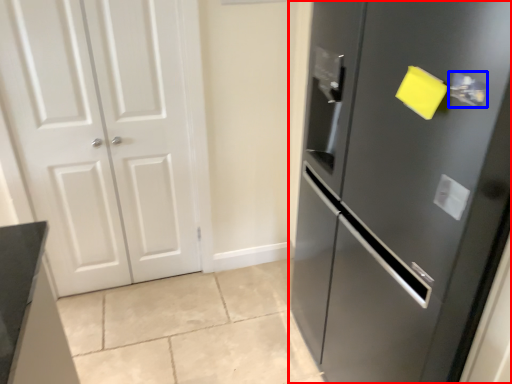
Question: Which of the following is the closest to the observer, door (highlighted by a red box) or door handle (highlighted by a blue box)?

Choices:
 (A) door
 (B) door handle

Answer: (A)